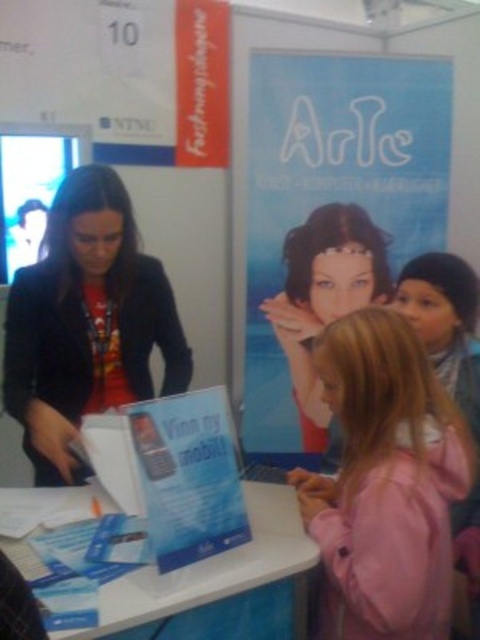
Question: Which object is farther from the camera taking this photo?

Choices:
 (A) white plastic table at lower center
 (B) smooth matte face at center
 (C) blue paper poster at center
 (D) matte black jacket at left

Answer: (B)

Question: Is pink fabric jacket at lower right to the right of smooth matte face at center from the viewer's perspective?

Choices:
 (A) yes
 (B) no

Answer: (A)

Question: Does pink fabric jacket at lower right lie behind matte black jacket at left?

Choices:
 (A) yes
 (B) no

Answer: (B)

Question: Which object is farther from the camera taking this photo?

Choices:
 (A) white plastic table at lower center
 (B) smooth matte face at center
 (C) matte black jacket at left
 (D) blue paper poster at center

Answer: (B)

Question: Can you confirm if smooth matte face at center is wider than white plastic table at lower center?

Choices:
 (A) no
 (B) yes

Answer: (B)

Question: Which of these objects is positioned farthest from the pink fabric jacket at lower right?

Choices:
 (A) smooth matte face at center
 (B) matte black jacket at left
 (C) blue paper poster at center
 (D) white plastic table at lower center

Answer: (C)